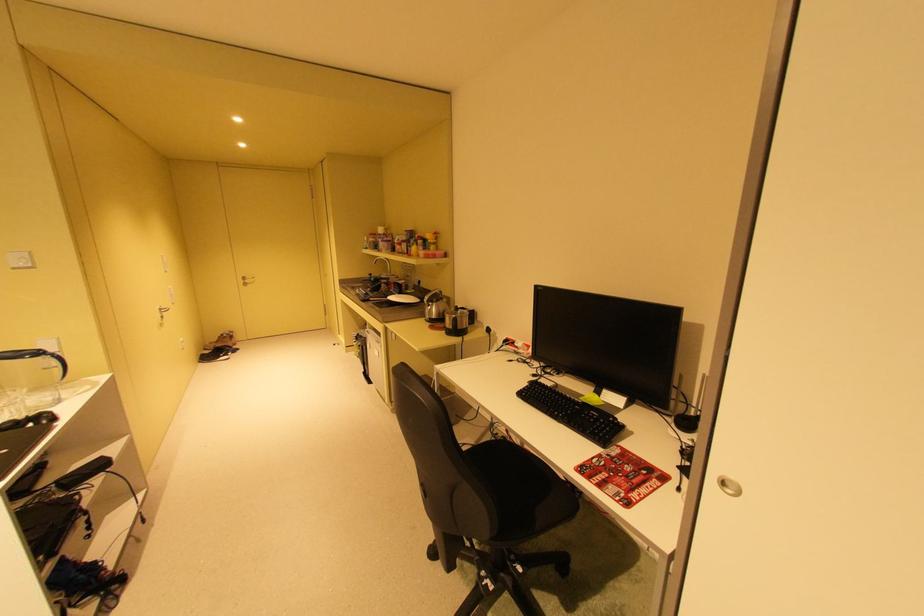
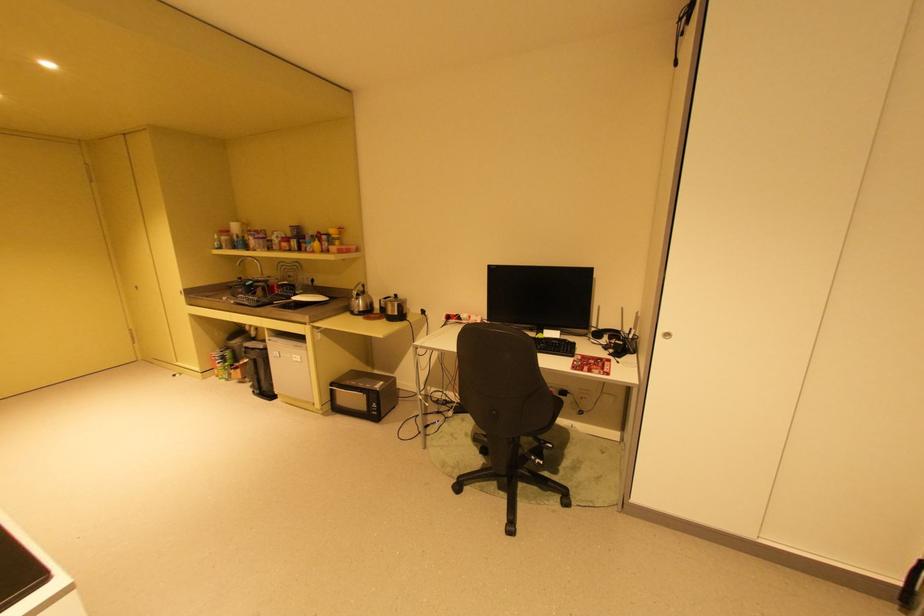
Find the pixel in the second image that matches point (690, 453) in the first image.

(614, 349)